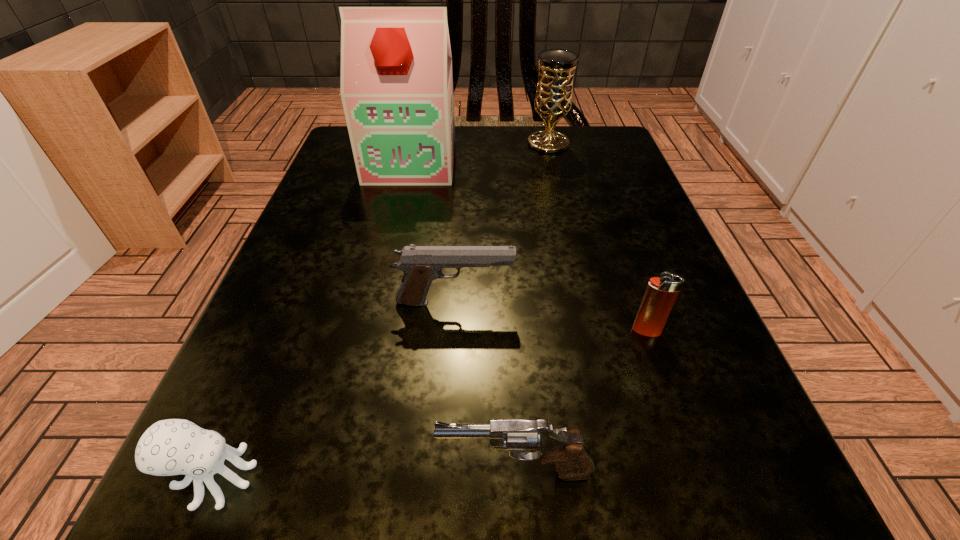
Where is `free location located 0.200m on the front of the rightmost object`? free location located 0.200m on the front of the rightmost object is located at coordinates (708, 508).

Locate an element on the screen. free space located at the barrel of the nearer pistol is located at coordinates tap(379, 471).

The height and width of the screenshot is (540, 960). Find the location of `vacant space located at the barrel of the nearer pistol`. vacant space located at the barrel of the nearer pistol is located at coordinates (227, 471).

Where is `vacant space located 0.050m at the barrel of the nearer pistol`? This screenshot has width=960, height=540. vacant space located 0.050m at the barrel of the nearer pistol is located at coordinates (389, 471).

Identify the location of vacant point located 0.240m on the front-facing side of the octopus. The width and height of the screenshot is (960, 540). (502, 477).

Locate an element on the screen. soya milk present at the far edge is located at coordinates (396, 88).

Where is `chalice present at the far edge`? This screenshot has width=960, height=540. chalice present at the far edge is located at coordinates (553, 100).

Find the location of a particular element. The image size is (960, 540). pistol at the near edge is located at coordinates (572, 460).

Locate an element on the screen. octopus positioned at the near edge is located at coordinates (169, 447).

The width and height of the screenshot is (960, 540). In order to click on soya milk that is at the left edge in this screenshot , I will do `click(396, 88)`.